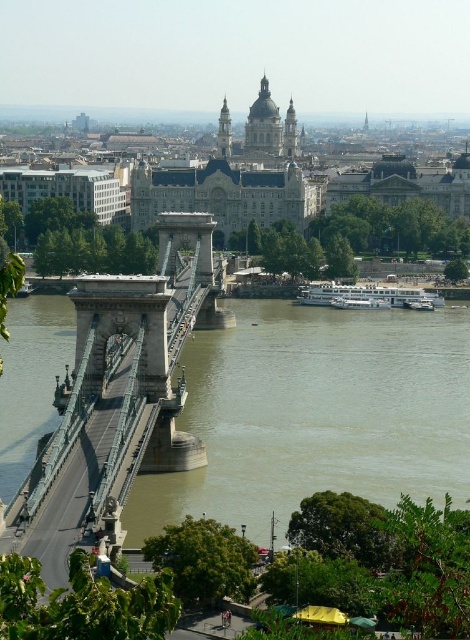
Question: Which of the following is the farthest from the observer?

Choices:
 (A) (284, 129)
 (B) (164, 236)
 (C) (258, 358)

Answer: (A)

Question: Does green metallic suspension bridge at center have a lesser width compared to golden stone tower at upper center?

Choices:
 (A) yes
 (B) no

Answer: (A)

Question: Is green stone bridge at center above green metallic suspension bridge at center?

Choices:
 (A) yes
 (B) no

Answer: (B)

Question: In this image, where is green metallic suspension bridge at center located relative to golden stone tower at upper center?

Choices:
 (A) above
 (B) below

Answer: (B)

Question: Based on their relative distances, which object is farther from the green metallic suspension bridge at center?

Choices:
 (A) golden stone tower at upper center
 (B) green stone bridge at center

Answer: (A)

Question: Among these objects, which one is nearest to the camera?

Choices:
 (A) green stone bridge at center
 (B) golden stone tower at upper center

Answer: (A)